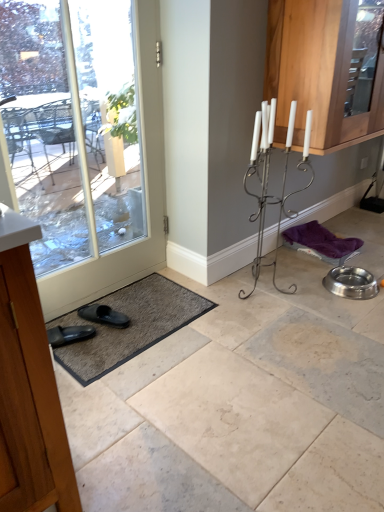
The height and width of the screenshot is (512, 384). Find the location of `blank area to the left of metallic silver candle holder at center right`. blank area to the left of metallic silver candle holder at center right is located at coordinates (210, 296).